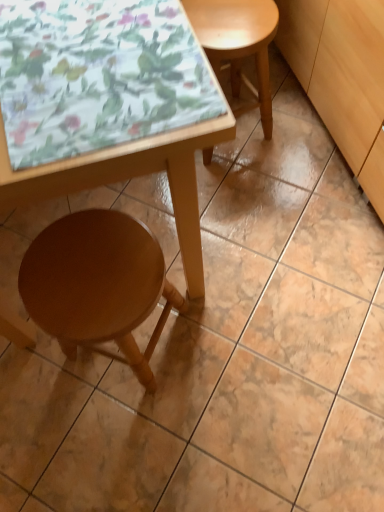
Where is `empty space that is ontop of wooden stool at lower left, the 2th stool when ordered from right to left (from a real-world perspective)`? empty space that is ontop of wooden stool at lower left, the 2th stool when ordered from right to left (from a real-world perspective) is located at coordinates (85, 271).